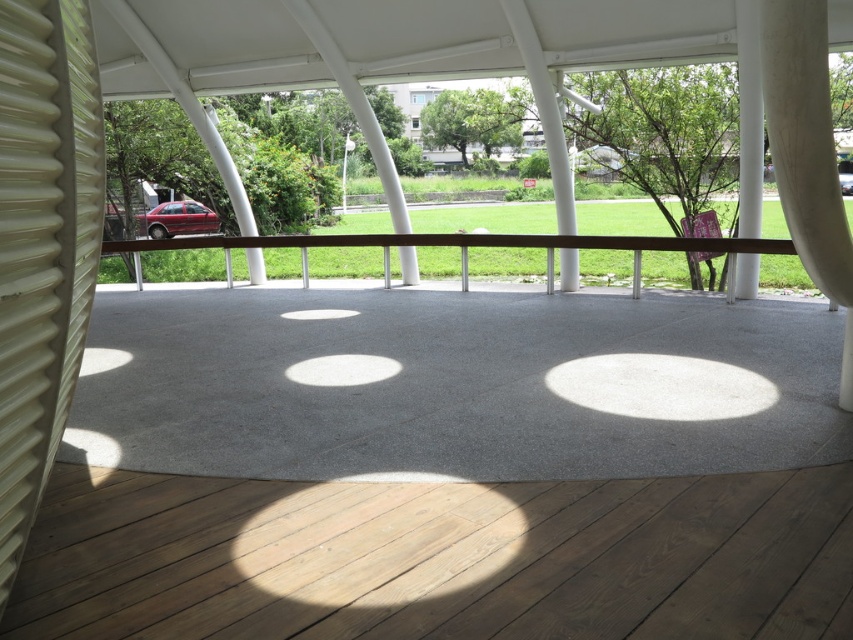
Does white corrugated plastic at left have a greater width compared to white matte curtain at upper right?

Incorrect, white corrugated plastic at left's width does not surpass white matte curtain at upper right's.

The width and height of the screenshot is (853, 640). Find the location of `white corrugated plastic at left`. white corrugated plastic at left is located at coordinates (42, 243).

Does point (790, 179) come in front of point (177, 212)?

Yes, point (790, 179) is in front of point (177, 212).

Between white matte curtain at upper right and matte red car at left, which one has more height?

Standing taller between the two is matte red car at left.

Which is in front, point (799, 230) or point (209, 224)?

Point (799, 230) is in front.

Locate an element on the screen. This screenshot has width=853, height=640. white matte curtain at upper right is located at coordinates (805, 140).

Does white matte curtain at upper right appear on the left side of brown polished wood rail at center?

In fact, white matte curtain at upper right is to the right of brown polished wood rail at center.

Which is behind, point (793, 236) or point (610, 243)?

Positioned behind is point (610, 243).

Where is `white matte curtain at upper right`? white matte curtain at upper right is located at coordinates (805, 140).